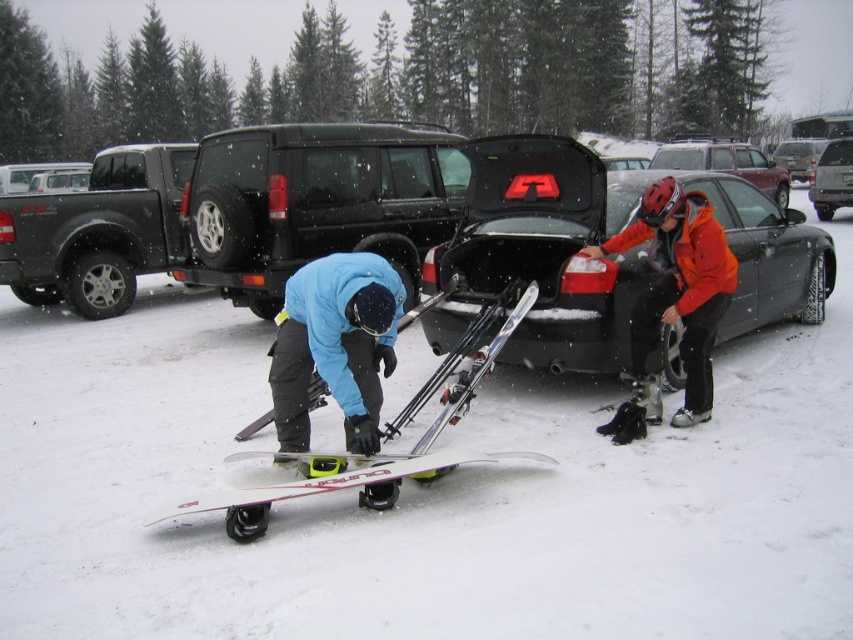
Between black matte suv at center and white matte snowboard at lower center, which one is positioned lower?

white matte snowboard at lower center is lower down.

Is black matte suv at center in front of white matte snowboard at lower center?

No, black matte suv at center is behind white matte snowboard at lower center.

Describe the element at coordinates (315, 202) in the screenshot. I see `black matte suv at center` at that location.

Locate an element on the screen. The height and width of the screenshot is (640, 853). black matte suv at center is located at coordinates (315, 202).

Can you confirm if black matte suv at center is wider than matte blue snowboard at center?

Yes, black matte suv at center is wider than matte blue snowboard at center.

Who is positioned more to the right, black matte suv at center or matte blue snowboard at center?

matte blue snowboard at center is more to the right.

Measure the distance between black matte suv at center and camera.

black matte suv at center is 25.31 feet away from camera.

You are a GUI agent. You are given a task and a screenshot of the screen. Output one action in this format:
    pyautogui.click(x=<x>, y=<y>)
    Task: Click on the black matte suv at center
    The height and width of the screenshot is (640, 853).
    Given the screenshot: What is the action you would take?
    pyautogui.click(x=315, y=202)

Can you confirm if black matte suv at center is wider than matte black truck at left?

Incorrect, black matte suv at center's width does not surpass matte black truck at left's.

Which is more to the right, black matte suv at center or matte black truck at left?

black matte suv at center

Who is more forward, [282,132] or [134,227]?

Point [282,132] is in front.

Locate an element on the screen. This screenshot has height=640, width=853. black matte suv at center is located at coordinates (315, 202).